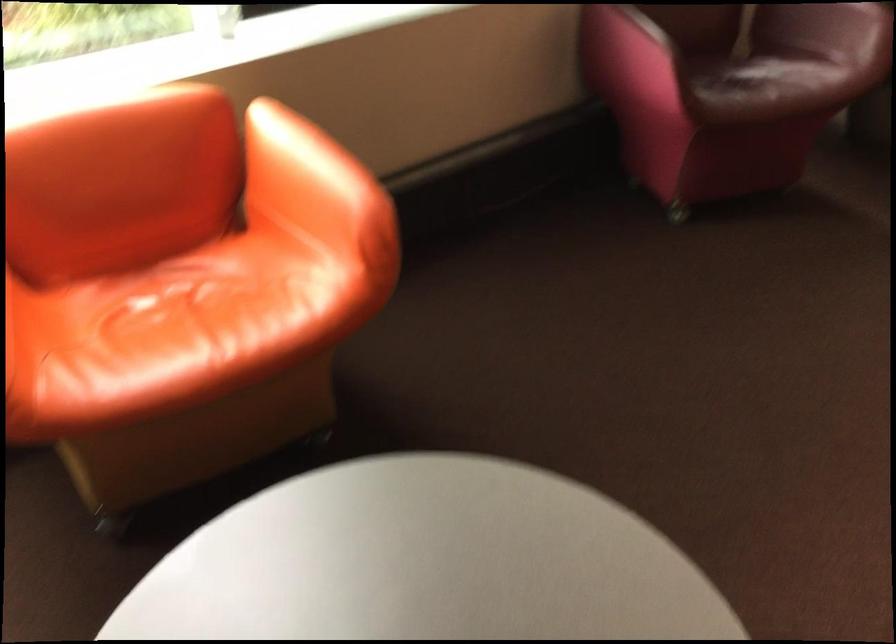
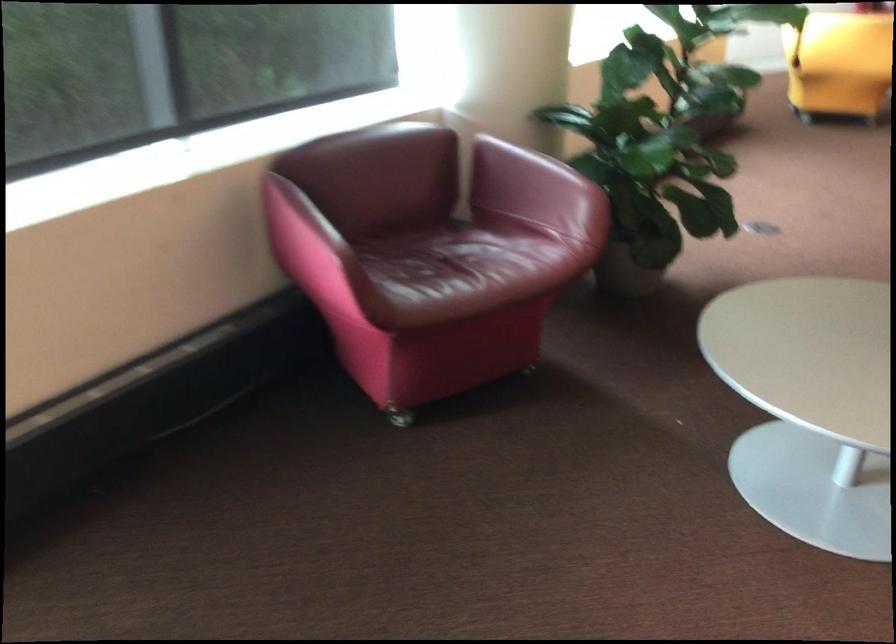
Question: How did the camera likely rotate?

Choices:
 (A) Left
 (B) Right
 (C) Up
 (D) Down

Answer: (B)